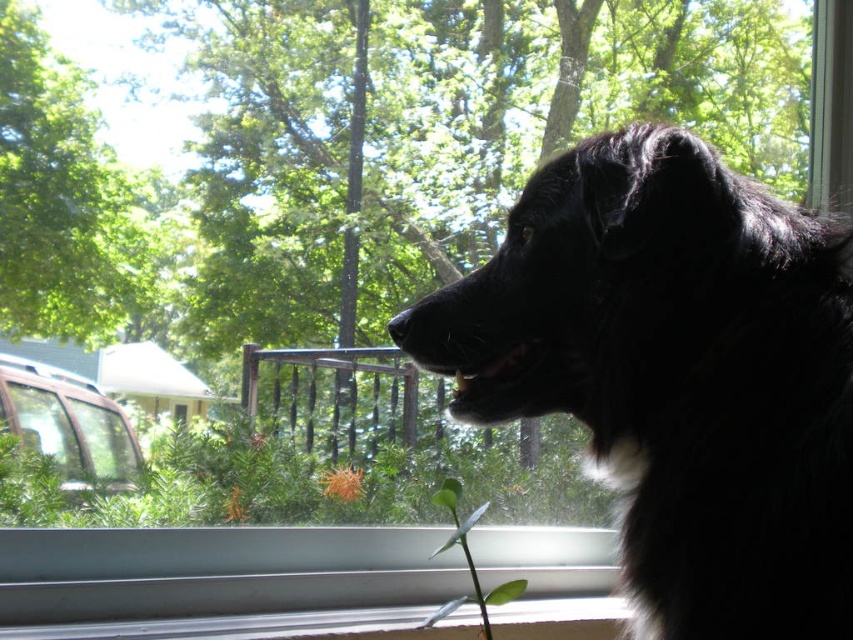
You are a small robot with a diameter of 8 inches. You need to move from the black fluffy dog at upper right to the green leafy stem at lower center. Can you fit through the space between them?

The distance between the black fluffy dog at upper right and the green leafy stem at lower center is 11.54 inches. Since your robot has a diameter of 8 inches, you can comfortably move through the space as the distance is greater than your size.

You are an animal trainer assessing the space for a new dog. You see the black fluffy dog at upper right and the green leafy tree at upper left in the scene. Based on their sizes, which one is shorter?

The black fluffy dog at upper right is shorter than the green leafy tree at upper left.

You are a photographer trying to capture both the black fluffy dog at upper right and the green leafy tree at upper left in a single frame. Based on their sizes in the image, which one would you need to position closer to the camera to ensure both appear similarly sized?

The black fluffy dog at upper right is bigger than the green leafy tree at upper left, so to make them appear similarly sized in the photo, you should move the black fluffy dog at upper right farther away from the camera and bring the green leafy tree at upper left closer. This way, their sizes in the frame will balance out.